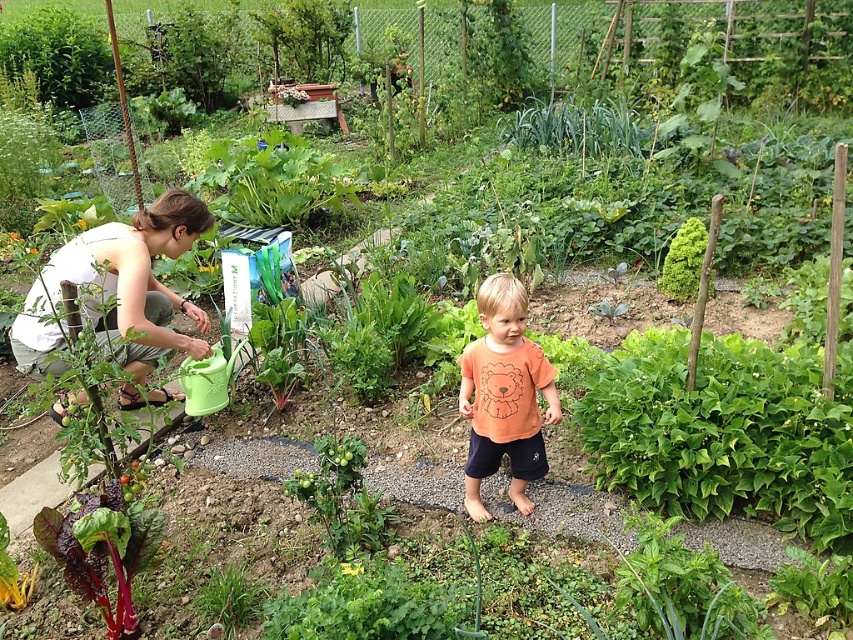
Question: Does white cotton shirt at left have a smaller size compared to deep red leafy vegetable at lower left?

Choices:
 (A) yes
 (B) no

Answer: (B)

Question: Which point is closer to the camera?

Choices:
 (A) (125, 282)
 (B) (503, 435)

Answer: (B)

Question: Does white cotton shirt at left have a smaller size compared to deep red leafy vegetable at lower left?

Choices:
 (A) no
 (B) yes

Answer: (A)

Question: Among these objects, which one is farthest from the camera?

Choices:
 (A) deep red leafy vegetable at lower left
 (B) orange cotton shirt at center

Answer: (B)

Question: Does white cotton shirt at left have a greater width compared to deep red leafy vegetable at lower left?

Choices:
 (A) no
 (B) yes

Answer: (B)

Question: Based on their relative distances, which object is nearer to the white cotton shirt at left?

Choices:
 (A) deep red leafy vegetable at lower left
 (B) orange cotton shirt at center

Answer: (A)